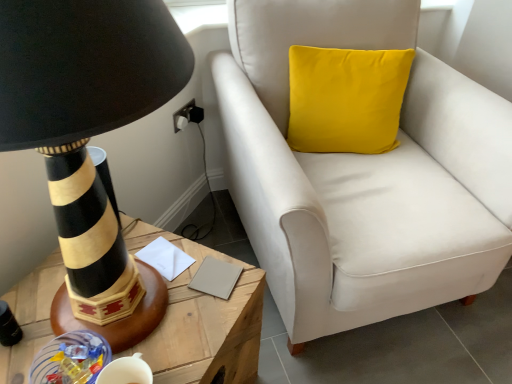
Where is `vacant space to the right of white paper at center, which is the 2th notepad in right-to-left order`? This screenshot has height=384, width=512. vacant space to the right of white paper at center, which is the 2th notepad in right-to-left order is located at coordinates (216, 272).